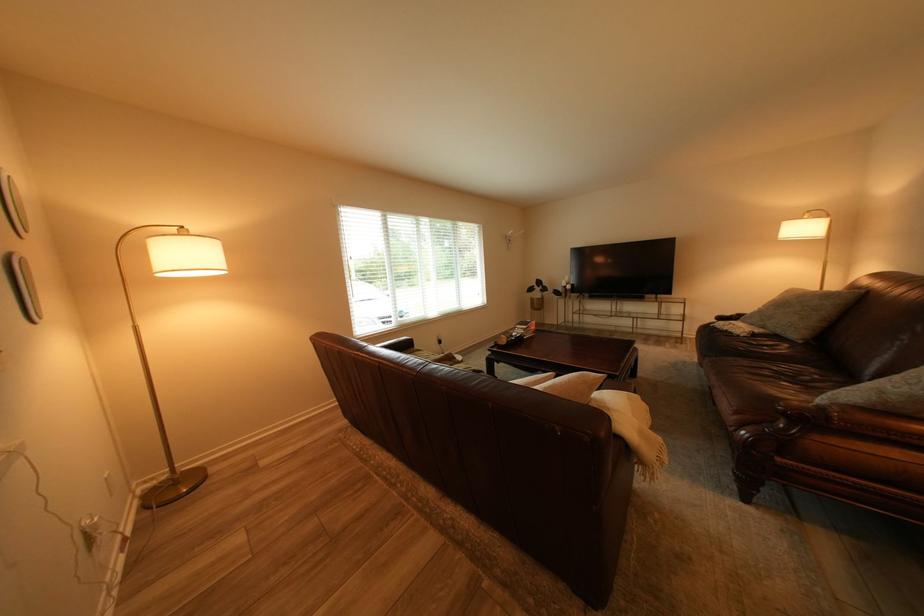
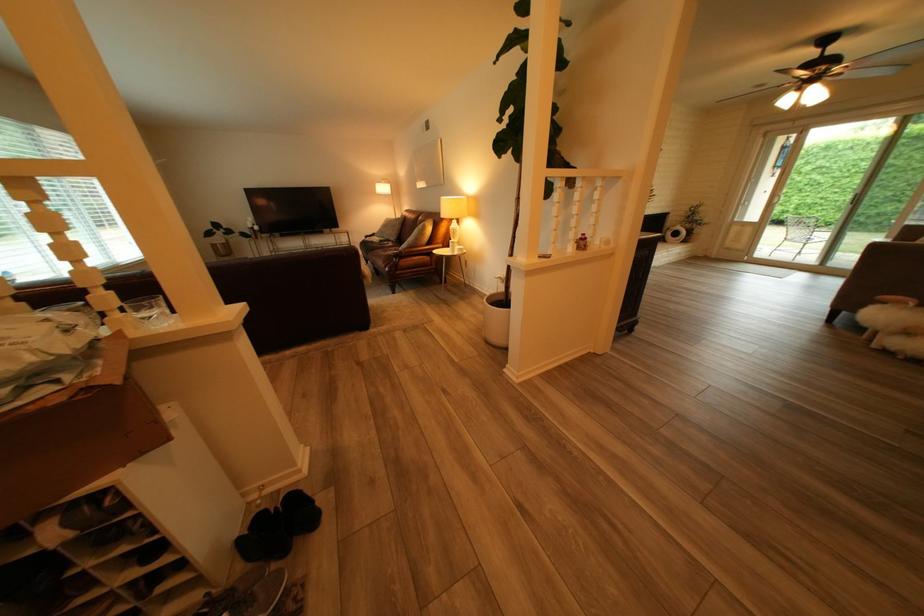
Find the pixel in the second image that matches (x=736, y=318) in the first image.

(381, 238)